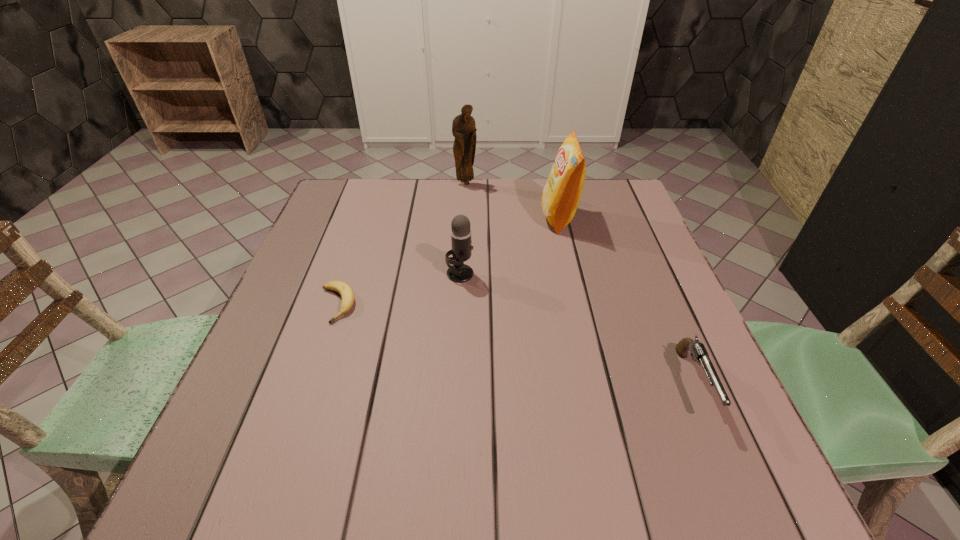
This screenshot has height=540, width=960. Identify the location of figurine. (464, 129).

Identify the location of crisp (potato chip). (560, 198).

Find the location of a particular element. the second object from right to left is located at coordinates (560, 198).

The image size is (960, 540). I want to click on microphone, so click(461, 251).

You are a GUI agent. You are given a task and a screenshot of the screen. Output one action in this format:
    pyautogui.click(x=<x>, y=<y>)
    Task: Click on the third nearest object
    The width and height of the screenshot is (960, 540).
    Given the screenshot: What is the action you would take?
    pyautogui.click(x=461, y=251)

Find the location of a particular element. The image size is (960, 540). the rightmost object is located at coordinates (698, 351).

You are a GUI agent. You are given a task and a screenshot of the screen. Output one action in this format:
    pyautogui.click(x=<x>, y=<y>)
    Task: Click on the nearest object
    This screenshot has height=540, width=960.
    Given the screenshot: What is the action you would take?
    pyautogui.click(x=698, y=351)

You are a GUI agent. You are given a task and a screenshot of the screen. Output one action in this format:
    pyautogui.click(x=<x>, y=<y>)
    Task: Click on the banana
    The image size is (960, 540).
    Given the screenshot: What is the action you would take?
    pyautogui.click(x=347, y=295)

Identify the location of the second nearest object. The image size is (960, 540). [347, 295].

Where is `blank space located on the front-facing side of the figurine`? The height and width of the screenshot is (540, 960). blank space located on the front-facing side of the figurine is located at coordinates (463, 238).